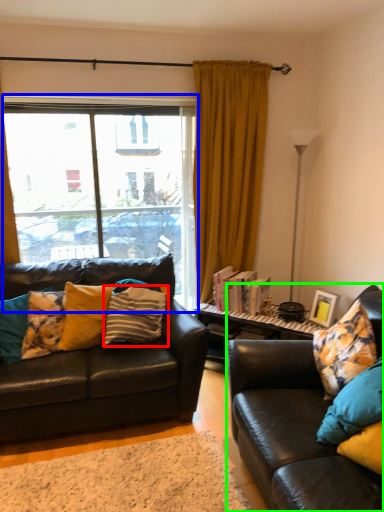
Question: Estimate the real-world distances between objects in this image. Which object is farther from pillow (highlighted by a red box), window (highlighted by a blue box) or studio couch (highlighted by a green box)?

Choices:
 (A) window
 (B) studio couch

Answer: (B)